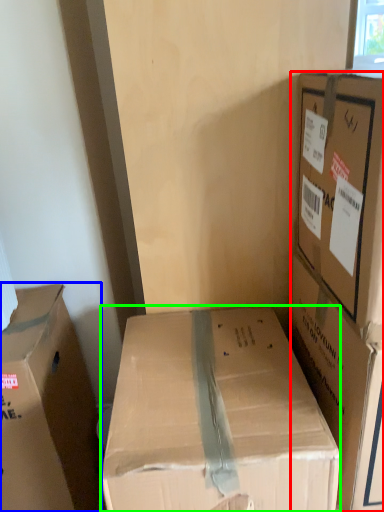
Question: Which is farther away from box (highlighted by a red box)? box (highlighted by a blue box) or box (highlighted by a green box)?

Choices:
 (A) box
 (B) box

Answer: (A)